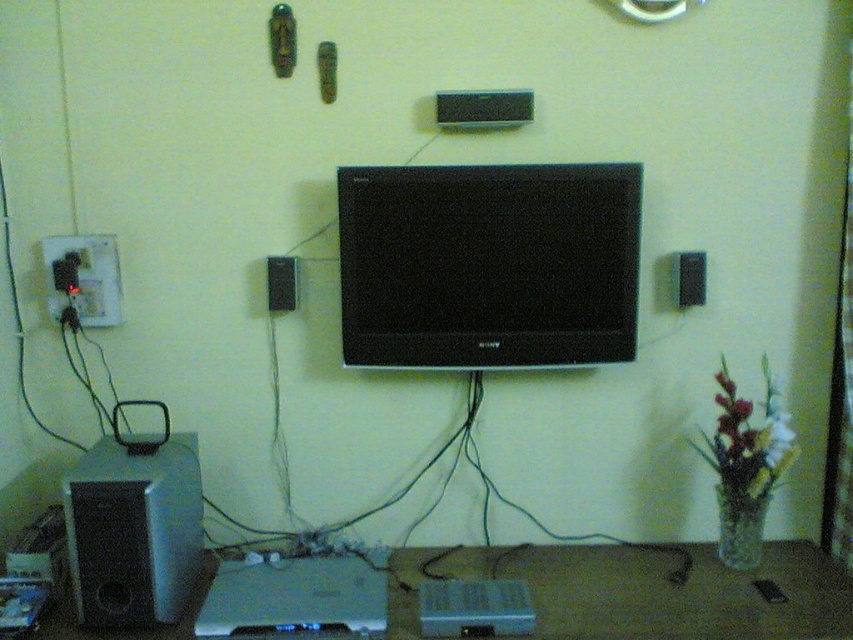
You are standing in front of the home entertainment system and want to place a remote control on the nearest object. Which object should you choose between the brown wooden table at lower center and the silver metallic speaker at lower left?

The brown wooden table at lower center is closer to you than the silver metallic speaker at lower left, so you should place the remote control on the brown wooden table at lower center.

You are setting up a new home theater system and need to place a remote control between the silver metallic speaker at lower left and the black matte speaker at upper center. Based on their positions, which speaker should the remote be closer to?

The remote control should be placed closer to the black matte speaker at upper center because the silver metallic speaker at lower left is positioned to the left of it.

You are setting up a new entertainment system and need to place a cable from the black plastic plug at left to the brown wooden table at lower center. Based on the scene, will the cable reach without needing to extend it?

The brown wooden table at lower center is below the black plastic plug at left, so the cable should reach without needing to extend it.